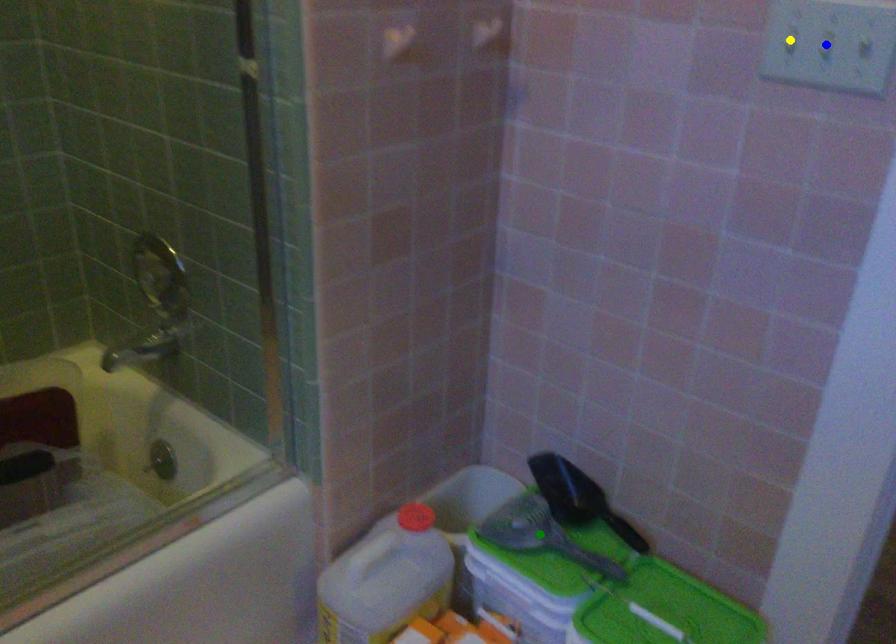
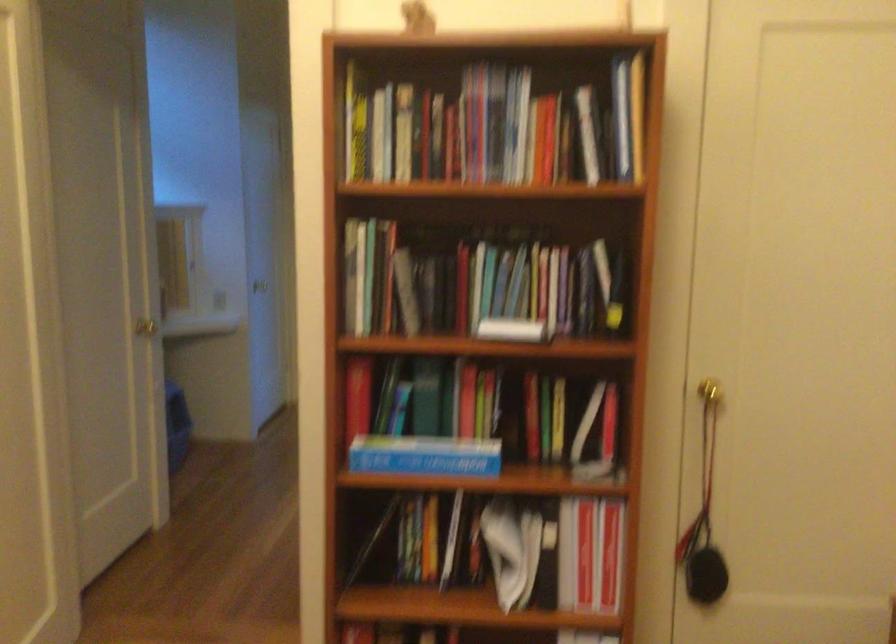
I am providing you with two images of the same scene from different viewpoints. Three points are marked in image1. Which point corresponds to a part or object that is occluded in image2?In image1, three points are marked. Which of them correspond to a part or object that is occluded in image2?Among the three points shown in image1, which one corresponds to a part or object that is no longer visible due to occlusion in image2?

yellow point, green point, blue point